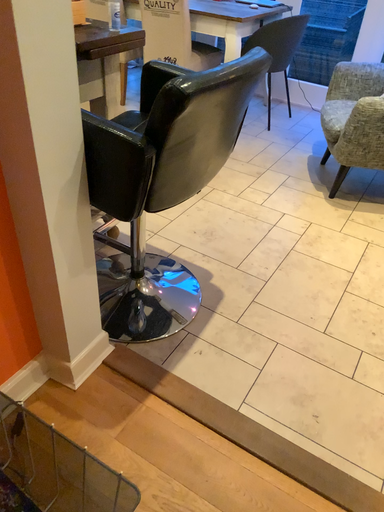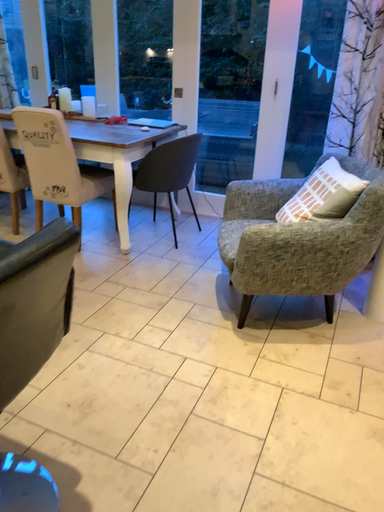
Question: Which way did the camera rotate in the video?

Choices:
 (A) rotated downward
 (B) rotated upward

Answer: (B)